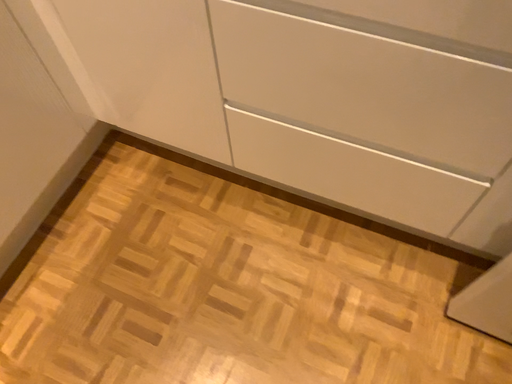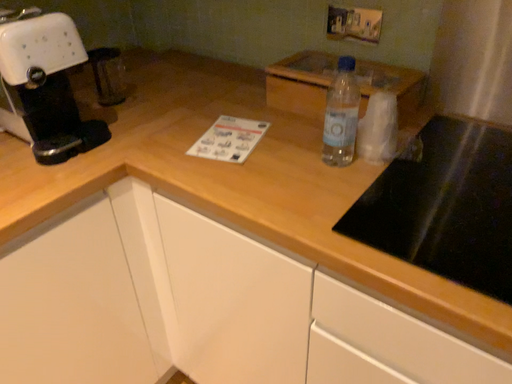
Question: Which way did the camera rotate in the video?

Choices:
 (A) rotated upward
 (B) rotated downward

Answer: (A)